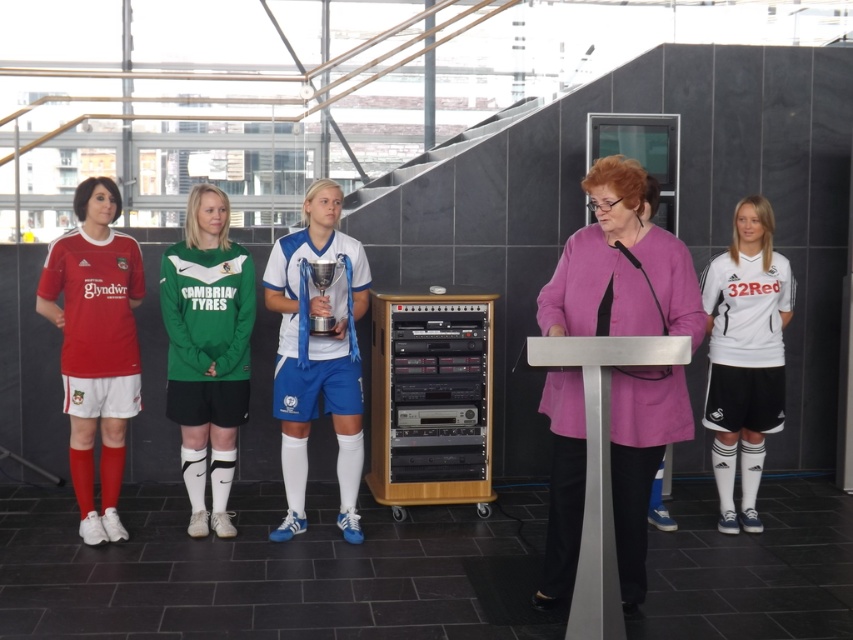
Question: Does blue fabric jersey at center appear on the right side of white jersey at center?

Choices:
 (A) no
 (B) yes

Answer: (A)

Question: Among these objects, which one is nearest to the camera?

Choices:
 (A) blue fabric jersey at center
 (B) matte red jersey at left
 (C) green jersey at center
 (D) pink fabric jacket at center

Answer: (D)

Question: Among these objects, which one is farthest from the camera?

Choices:
 (A) silver metallic trophy at center
 (B) matte red jersey at left
 (C) white jersey at center

Answer: (C)

Question: Which of the following is the farthest from the observer?

Choices:
 (A) pink fabric jacket at center
 (B) blue fabric jersey at center
 (C) white jersey at center
 (D) matte red jersey at left

Answer: (C)

Question: Is pink fabric jacket at center further to camera compared to green jersey at center?

Choices:
 (A) no
 (B) yes

Answer: (A)

Question: Is matte red jersey at left smaller than green jersey at center?

Choices:
 (A) yes
 (B) no

Answer: (B)